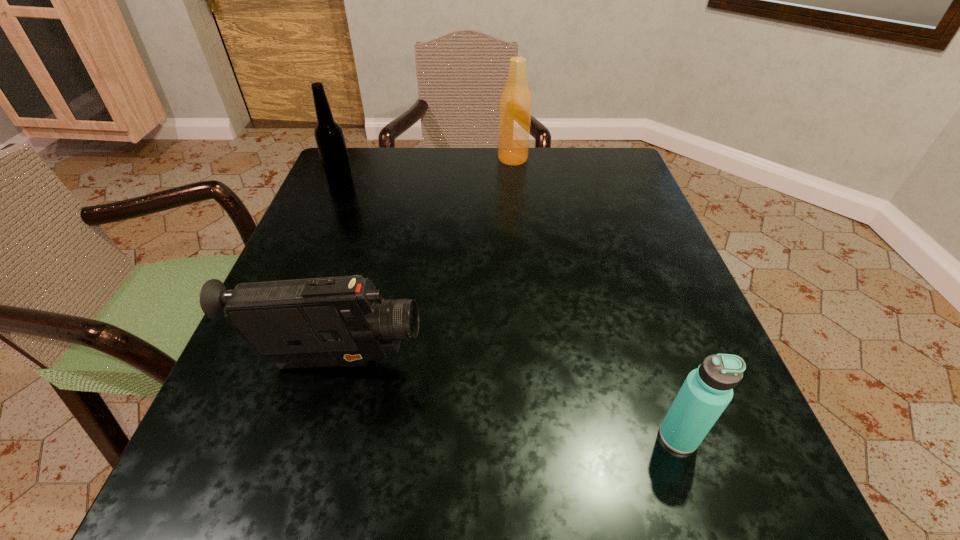
You are a GUI agent. You are given a task and a screenshot of the screen. Output one action in this format:
    pyautogui.click(x=<x>, y=<y>)
    Task: Click on the farther beer bottle
    This screenshot has width=960, height=540.
    Given the screenshot: What is the action you would take?
    pyautogui.click(x=515, y=107)

The width and height of the screenshot is (960, 540). Identify the location of the farthest object. (515, 107).

Locate an element on the screen. The image size is (960, 540). the nearer beer bottle is located at coordinates (329, 136).

This screenshot has width=960, height=540. Identify the location of the third nearest object. (329, 136).

This screenshot has width=960, height=540. What are the coordinates of `the second nearest object` in the screenshot? It's located at pyautogui.click(x=331, y=321).

Find the location of a particular element. The image size is (960, 540). the rightmost object is located at coordinates (706, 392).

You are a GUI agent. You are given a task and a screenshot of the screen. Output one action in this format:
    pyautogui.click(x=<x>, y=<y>)
    Task: Click on the nearest object
    
    Given the screenshot: What is the action you would take?
    pyautogui.click(x=706, y=392)

The image size is (960, 540). I want to click on free space located on the left of the farther beer bottle, so click(422, 159).

Identify the location of vacant area situated 0.390m on the front of the nearer beer bottle. (283, 321).

The image size is (960, 540). Find the location of `free spot located on the front-facing side of the third farthest object`. free spot located on the front-facing side of the third farthest object is located at coordinates tap(622, 363).